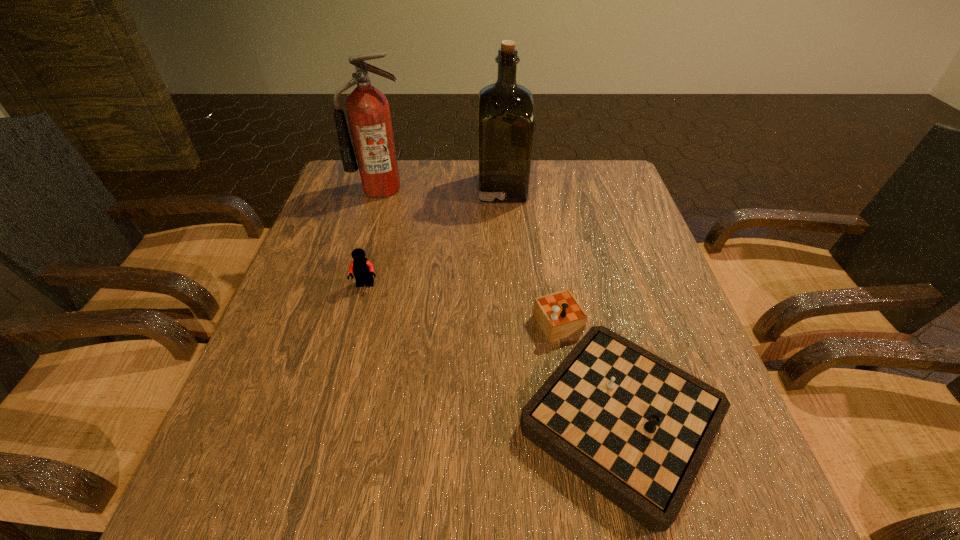
You are a GUI agent. You are given a task and a screenshot of the screen. Output one action in this format:
    pyautogui.click(x=<x>, y=<y>)
    Task: Click on the liquor
    The image size is (960, 540).
    Given the screenshot: What is the action you would take?
    pyautogui.click(x=505, y=110)

Find the location of a particular element. This screenshot has width=960, height=540. fire extinguisher is located at coordinates (368, 111).

You are a GUI agent. You are given a task and a screenshot of the screen. Output one action in this format:
    pyautogui.click(x=<x>, y=<y>)
    Task: Click on the Lego
    The height and width of the screenshot is (540, 960).
    Given the screenshot: What is the action you would take?
    pyautogui.click(x=362, y=269)

I want to click on chessboard, so click(x=636, y=428).

In order to click on the nearest object in this screenshot , I will do `click(636, 428)`.

What are the coordinates of `vacant space located 0.250m on the label of the liquor` in the screenshot? It's located at coord(393,188).

Where is `vacant area situated 0.050m on the label of the liquor`? The height and width of the screenshot is (540, 960). vacant area situated 0.050m on the label of the liquor is located at coordinates (462, 188).

Locate an element on the screen. The width and height of the screenshot is (960, 540). vacant position located on the label of the liquor is located at coordinates (424, 188).

Where is `vacant area located on the front of the fire extinguisher near the operation label`? vacant area located on the front of the fire extinguisher near the operation label is located at coordinates (362, 255).

At what (x,y) coordinates should I click in order to perform the action: click on free location located 0.330m on the front-facing side of the second nearest object. Please return your answer as a coordinate pair (x, y). This screenshot has height=540, width=960. Looking at the image, I should click on (327, 430).